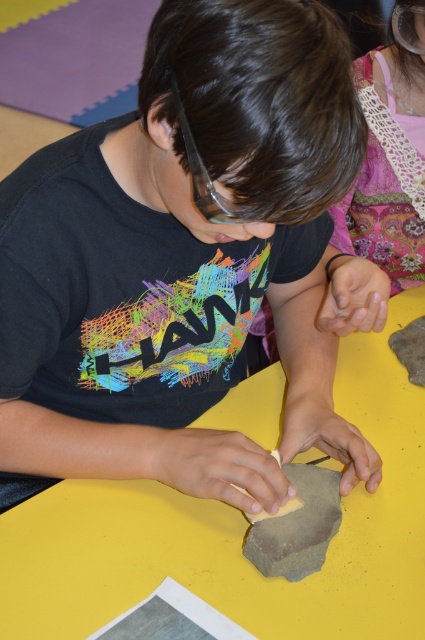
Does yellow matte table at center have a greater height compared to patterned fabric bag at upper right?

In fact, yellow matte table at center may be shorter than patterned fabric bag at upper right.

Does yellow matte table at center appear on the right side of patterned fabric bag at upper right?

Incorrect, yellow matte table at center is not on the right side of patterned fabric bag at upper right.

Between point (374, 500) and point (405, 84), which one is positioned behind?

The point (405, 84) is behind.

The image size is (425, 640). In order to click on yellow matte table at center in this screenshot , I will do `click(237, 532)`.

Is matte black shirt at center positioned behind patterned fabric bag at upper right?

No, matte black shirt at center is in front of patterned fabric bag at upper right.

Does matte black shirt at center appear under patterned fabric bag at upper right?

Correct, matte black shirt at center is located below patterned fabric bag at upper right.

Is point (209, 145) positioned after point (360, 97)?

No, it is not.

At what (x,y) coordinates should I click in order to perform the action: click on matte black shirt at center. Please return your answer as a coordinate pair (x, y). Looking at the image, I should click on (183, 259).

Does clear plastic goggles at center appear over clear plastic goggles at upper center?

Actually, clear plastic goggles at center is below clear plastic goggles at upper center.

Is clear plastic goggles at center smaller than clear plastic goggles at upper center?

Correct, clear plastic goggles at center occupies less space than clear plastic goggles at upper center.

Where is `clear plastic goggles at center`? The width and height of the screenshot is (425, 640). clear plastic goggles at center is located at coordinates (201, 173).